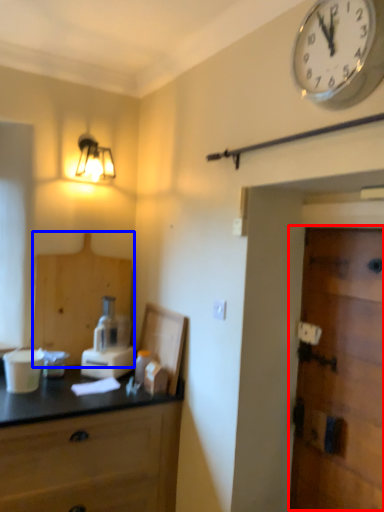
Question: Which object appears farthest to the camera in this image, door (highlighted by a red box) or cabinetry (highlighted by a blue box)?

Choices:
 (A) door
 (B) cabinetry

Answer: (B)